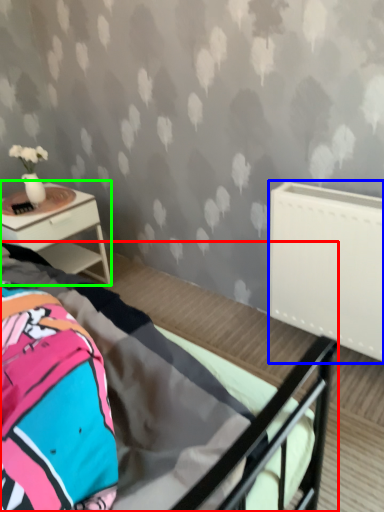
Question: Which is nearer to the bed (highlighted by a red box)? radiator (highlighted by a blue box) or nightstand (highlighted by a green box).

Choices:
 (A) radiator
 (B) nightstand

Answer: (A)